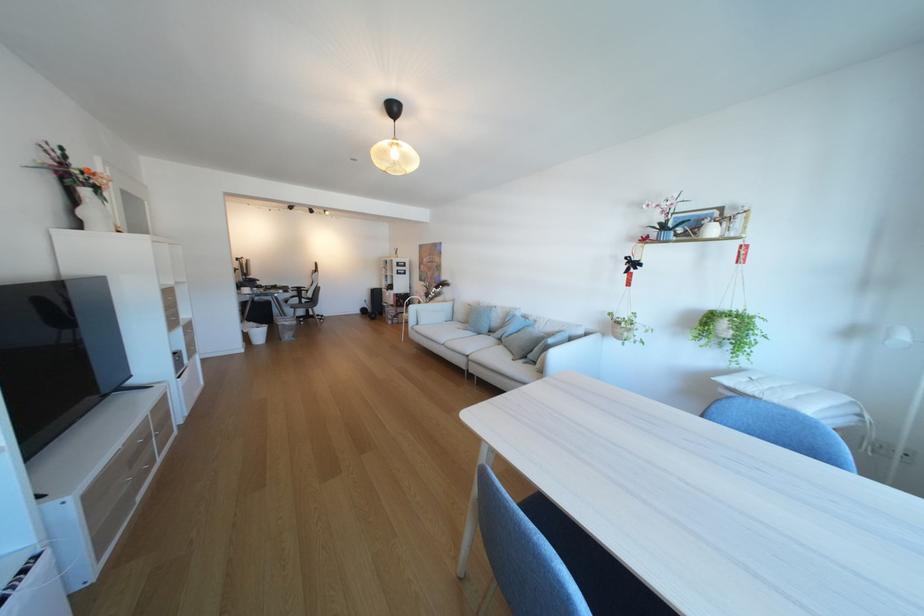
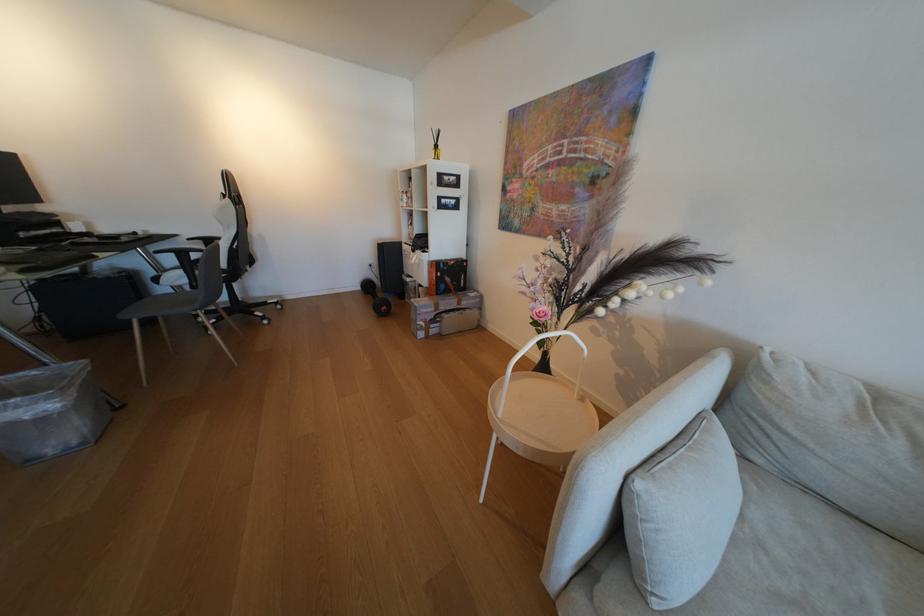
The point at (309, 302) is marked in the first image. Where is the corresponding point in the second image?

(196, 282)